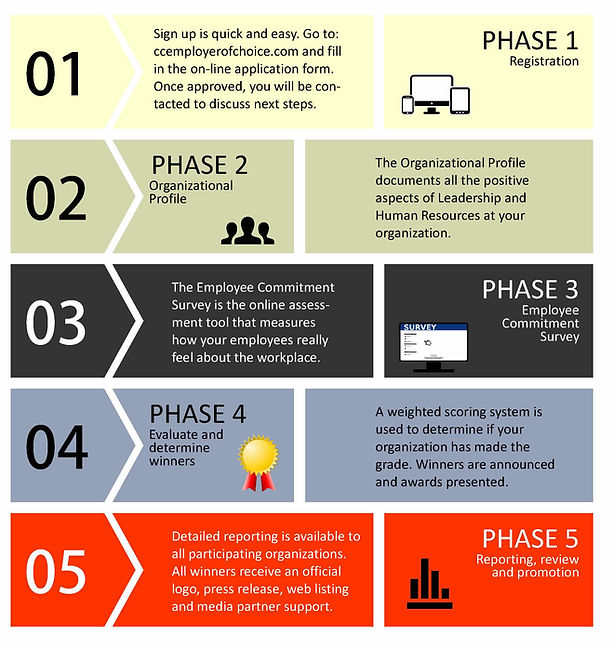
Identify the location of monitors. (439, 338), (425, 82).